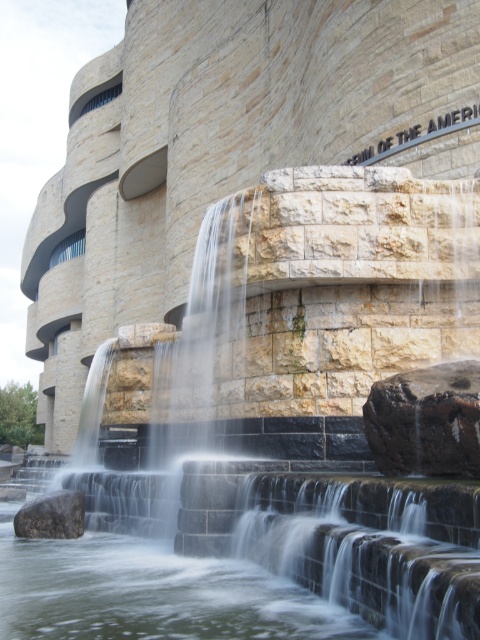
Looking at this image, you are a landscape architect evaluating the design of this modern structure. You need to determine if the smooth stone waterfall at center can be widened to match the brown rough rock at lower left in width without altering their positions. Based on the scene description, what would you advise?

The smooth stone waterfall at center is already wider than the brown rough rock at lower left. Therefore, it cannot be widened to match the brown rough rock at lower left in width without reducing its current width.

You are standing in front of the modern architectural structure and want to locate two specific points on the facade. The first point is at coordinates point (307, 369) and the second is at point (474, 477). Which point is closer to you?

Point (307, 369) is closer to you because it is further to the viewer than point (474, 477).

You are standing in front of the modern architectural structure and want to place a small statue between the dark brown rock at center and the brown rough rock at lower left. Based on their positions, which rock should the statue be closer to?

The dark brown rock at center is positioned on the right side of brown rough rock at lower left, so the statue should be placed closer to the brown rough rock at lower left to maintain symmetry between them.